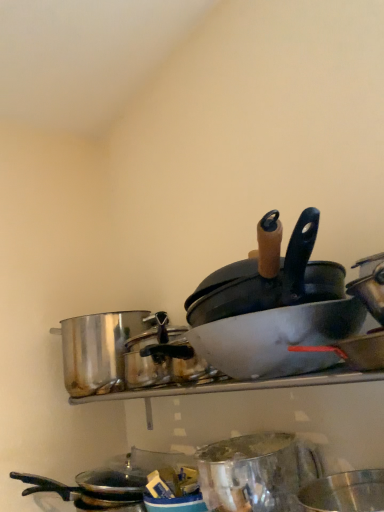
This screenshot has width=384, height=512. Describe the element at coordinates (98, 349) in the screenshot. I see `shiny metallic pot at left` at that location.

Describe the element at coordinates (270, 281) in the screenshot. This screenshot has width=384, height=512. I see `black matte frying pan at upper right` at that location.

The width and height of the screenshot is (384, 512). Describe the element at coordinates (256, 472) in the screenshot. I see `metallic silver mixing bowl at center` at that location.

Identify the location of shiny metallic pot at left. The image size is (384, 512). (98, 349).

Identify the location of basin below the metallic silver basin at center, which ranks as the 1th basin in top-to-bottom order (from the image's perspective). The height and width of the screenshot is (512, 384). (345, 492).

Between shiny metallic basin at lower right, the 2th basin when ordered from top to bottom, and metallic silver basin at center, which ranks as the 1th basin in top-to-bottom order, which one has larger width?

metallic silver basin at center, which ranks as the 1th basin in top-to-bottom order.

From a real-world perspective, is shiny metallic basin at lower right, which appears as the 1th basin when ordered from the bottom, positioned under metallic silver basin at center, arranged as the second basin when ordered from the bottom, based on gravity?

Yes, from a real-world perspective, shiny metallic basin at lower right, which appears as the 1th basin when ordered from the bottom, is under metallic silver basin at center, arranged as the second basin when ordered from the bottom.

Is point (379, 497) closer to camera compared to point (320, 362)?

No, it is not.

How distant is black matte frying pan at upper right from shiny metallic pot at left?

black matte frying pan at upper right is 57.76 centimeters away from shiny metallic pot at left.

Is black matte frying pan at upper right positioned in front of shiny metallic pot at left?

Yes, black matte frying pan at upper right is closer to the camera.

Can you tell me how much black matte frying pan at upper right and shiny metallic pot at left differ in facing direction?

The facing directions of black matte frying pan at upper right and shiny metallic pot at left are 0.000815 degrees apart.

Which object is thinner, black matte frying pan at upper right or shiny metallic pot at left?

shiny metallic pot at left.

Is metallic silver basin at center, arranged as the second basin when ordered from the bottom, at the back of matte white wok at center?

matte white wok at center is not turned away from metallic silver basin at center, arranged as the second basin when ordered from the bottom.

Is matte white wok at center taller than metallic silver basin at center, arranged as the second basin when ordered from the bottom?

No.

Which is more to the right, matte white wok at center or metallic silver basin at center, arranged as the second basin when ordered from the bottom?

matte white wok at center.

Locate an element on the screen. The width and height of the screenshot is (384, 512). wok lying on the right of metallic silver basin at center, which ranks as the 1th basin in top-to-bottom order is located at coordinates (354, 350).

Is metallic silver mixing bowl at center facing away from matte white wok at center?

No, metallic silver mixing bowl at center's orientation is not away from matte white wok at center.

Is metallic silver mixing bowl at center not close to matte white wok at center?

They are positioned close to each other.

From a real-world perspective, is metallic silver mixing bowl at center beneath matte white wok at center?

Indeed, from a real-world perspective, metallic silver mixing bowl at center is positioned beneath matte white wok at center.

Is black matte frying pan at upper right positioned in front of shiny metallic basin at lower right, which appears as the 1th basin when ordered from the bottom?

No.

Consider the image. Which object is thinner, black matte frying pan at upper right or shiny metallic basin at lower right, the 2th basin when ordered from top to bottom?

With smaller width is shiny metallic basin at lower right, the 2th basin when ordered from top to bottom.

Are black matte frying pan at upper right and shiny metallic basin at lower right, which appears as the 1th basin when ordered from the bottom, making contact?

No, black matte frying pan at upper right is not in contact with shiny metallic basin at lower right, which appears as the 1th basin when ordered from the bottom.

From the picture: Could you measure the distance between black matte frying pan at upper right and shiny metallic basin at lower right, which appears as the 1th basin when ordered from the bottom?

black matte frying pan at upper right is 15.97 inches from shiny metallic basin at lower right, which appears as the 1th basin when ordered from the bottom.

Which object is thinner, matte white wok at center or metallic silver mixing bowl at center?

Thinner between the two is matte white wok at center.

Is matte white wok at center bigger or smaller than metallic silver mixing bowl at center?

Clearly, matte white wok at center is smaller in size than metallic silver mixing bowl at center.

I want to click on wok positioned vertically above the metallic silver mixing bowl at center (from a real-world perspective), so click(354, 350).

From a real-world perspective, is metallic silver mixing bowl at center physically above black matte frying pan at upper right?

No, from a real-world perspective, metallic silver mixing bowl at center is not over black matte frying pan at upper right

From the image's perspective, is metallic silver mixing bowl at center located beneath black matte frying pan at upper right?

Correct, metallic silver mixing bowl at center appears lower than black matte frying pan at upper right in the image.

Which object is wider, metallic silver mixing bowl at center or black matte frying pan at upper right?

black matte frying pan at upper right is wider.

Is metallic silver mixing bowl at center positioned with its back to black matte frying pan at upper right?

No, metallic silver mixing bowl at center is not facing away from black matte frying pan at upper right.

There is a shiny metallic basin at lower right, the 2th basin when ordered from top to bottom. What are the coordinates of `basin above it (from a real-world perspective)` in the screenshot? It's located at click(x=277, y=338).

The image size is (384, 512). I want to click on crock pot that appears below the black matte frying pan at upper right (from the image's perspective), so click(98, 349).

Looking at this image, looking at the image, which one is located further to shiny metallic pot at left, shiny metallic basin at lower right, the 2th basin when ordered from top to bottom, or metallic silver basin at center, which ranks as the 1th basin in top-to-bottom order?

shiny metallic basin at lower right, the 2th basin when ordered from top to bottom.

Which object lies nearer to the anchor point metallic silver basin at center, which ranks as the 1th basin in top-to-bottom order, matte white wok at center or shiny metallic basin at lower right, which appears as the 1th basin when ordered from the bottom?

matte white wok at center is positioned closer to the anchor metallic silver basin at center, which ranks as the 1th basin in top-to-bottom order.

Looking at the image, which one is located closer to shiny metallic pot at left, metallic silver basin at center, arranged as the second basin when ordered from the bottom, or matte white wok at center?

The object closer to shiny metallic pot at left is metallic silver basin at center, arranged as the second basin when ordered from the bottom.

Which object lies further to the anchor point shiny metallic pot at left, shiny metallic basin at lower right, the 2th basin when ordered from top to bottom, or metallic silver mixing bowl at center?

The object further to shiny metallic pot at left is shiny metallic basin at lower right, the 2th basin when ordered from top to bottom.

Considering their positions, is metallic silver basin at center, which ranks as the 1th basin in top-to-bottom order, positioned closer to metallic silver mixing bowl at center than shiny metallic pot at left?

Among the two, metallic silver basin at center, which ranks as the 1th basin in top-to-bottom order, is located nearer to metallic silver mixing bowl at center.

Based on their spatial positions, is black matte frying pan at upper right or shiny metallic pot at left further from metallic silver basin at center, which ranks as the 1th basin in top-to-bottom order?

shiny metallic pot at left is further to metallic silver basin at center, which ranks as the 1th basin in top-to-bottom order.

When comparing their distances from black matte frying pan at upper right, does metallic silver basin at center, which ranks as the 1th basin in top-to-bottom order, or shiny metallic pot at left seem closer?

metallic silver basin at center, which ranks as the 1th basin in top-to-bottom order, lies closer to black matte frying pan at upper right than the other object.

When comparing their distances from shiny metallic pot at left, does black matte frying pan at upper right or metallic silver mixing bowl at center seem further?

black matte frying pan at upper right is positioned further to the anchor shiny metallic pot at left.

Where is `wok that lies between black matte frying pan at upper right and metallic silver mixing bowl at center from top to bottom`? wok that lies between black matte frying pan at upper right and metallic silver mixing bowl at center from top to bottom is located at coordinates (354, 350).

Find the location of a particular element. frying pan between metallic silver basin at center, arranged as the second basin when ordered from the bottom, and shiny metallic pot at left in the front-back direction is located at coordinates (270, 281).

I want to click on basin that lies between metallic silver basin at center, which ranks as the 1th basin in top-to-bottom order, and metallic silver mixing bowl at center from top to bottom, so click(x=345, y=492).

Locate an element on the screen. The width and height of the screenshot is (384, 512). mixing bowl between matte white wok at center and shiny metallic pot at left from front to back is located at coordinates (256, 472).